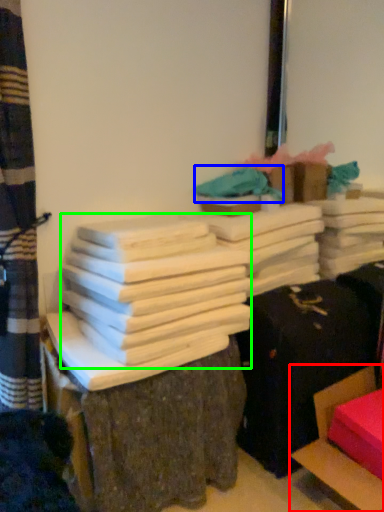
Question: Which object is positioned closest to furniture (highlighted by a red box)? Select from fabric (highlighted by a blue box) and bundle (highlighted by a green box).

Choices:
 (A) fabric
 (B) bundle

Answer: (B)